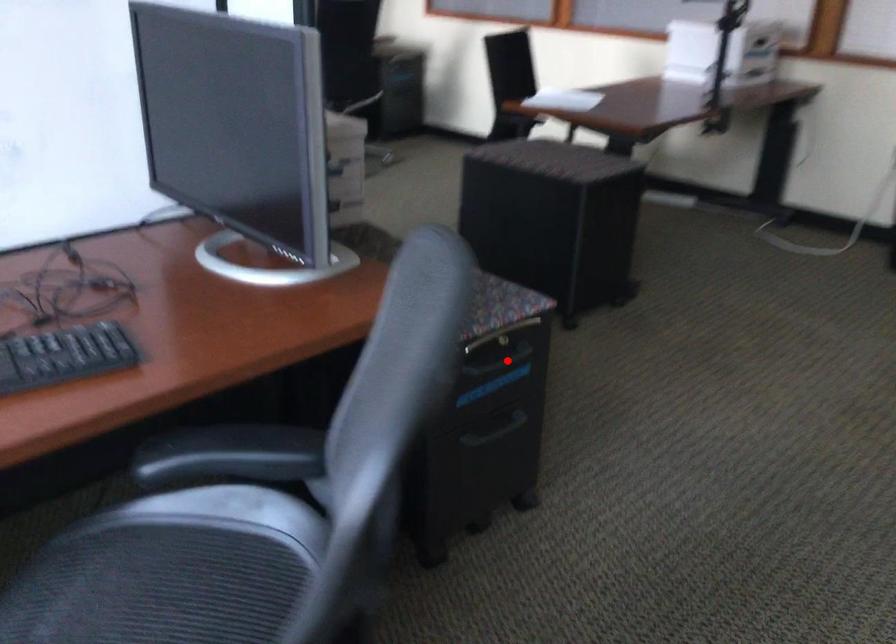
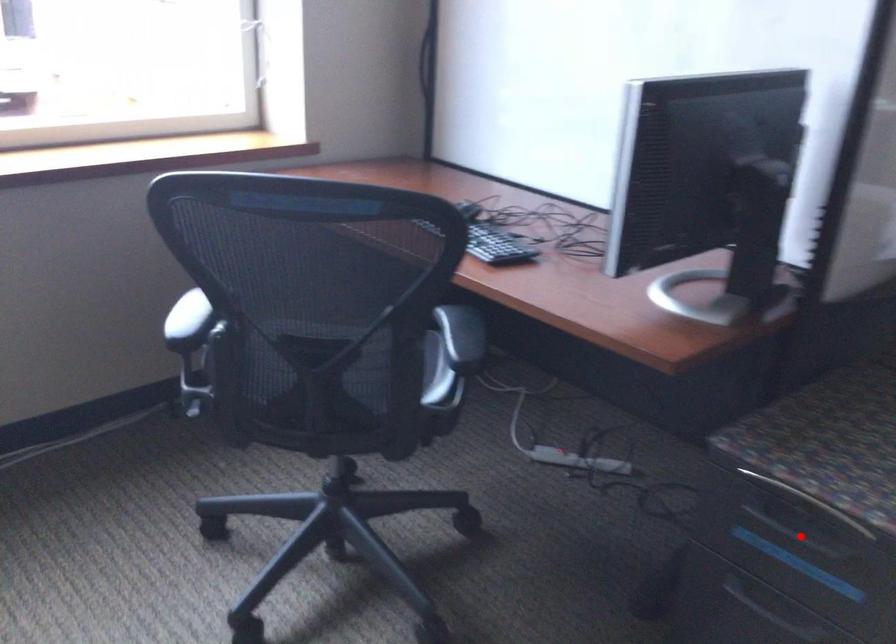
I am providing you with two images of the same scene from different viewpoints. A red point is marked on the first image and another point is marked on the second image. Does the point marked in image1 correspond to the same location as the one in image2?

Yes